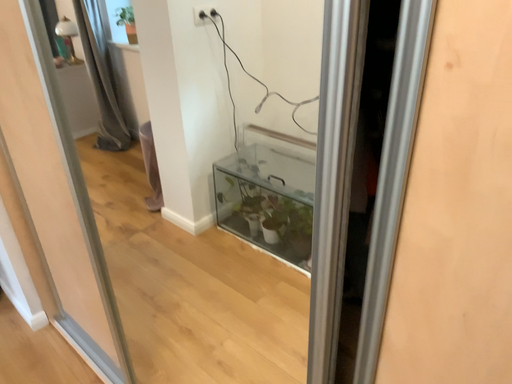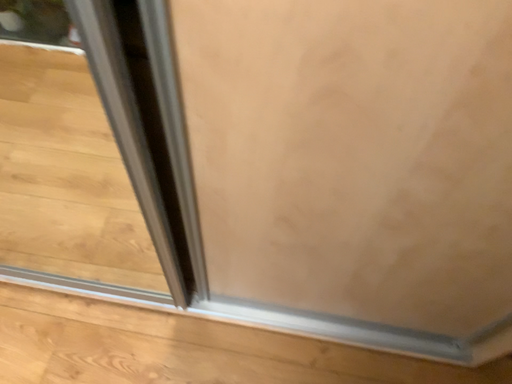
Question: How did the camera likely rotate when shooting the video?

Choices:
 (A) rotated upward
 (B) rotated downward

Answer: (B)